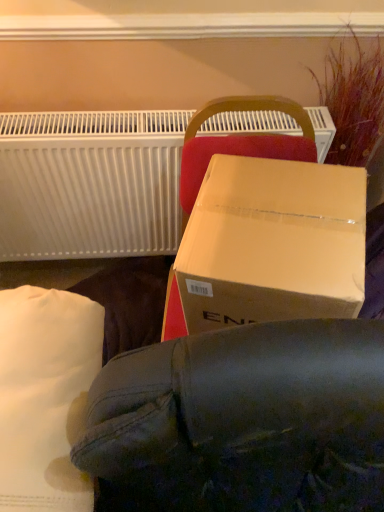
In order to face white matte radiator at upper left, should I rotate leftwards or rightwards?

Turn left approximately 10.833 degrees to face it.

Image resolution: width=384 pixels, height=512 pixels. What do you see at coordinates (90, 184) in the screenshot?
I see `white matte radiator at upper left` at bounding box center [90, 184].

In the scene shown: Measure the distance between white matte radiator at upper left and camera.

The distance of white matte radiator at upper left from camera is 3.75 feet.

This screenshot has height=512, width=384. I want to click on white matte radiator at upper left, so click(90, 184).

At what (x,y) coordinates should I click in order to perform the action: click on white matte radiator at upper left. Please return your answer as a coordinate pair (x, y). This screenshot has height=512, width=384. Looking at the image, I should click on (90, 184).